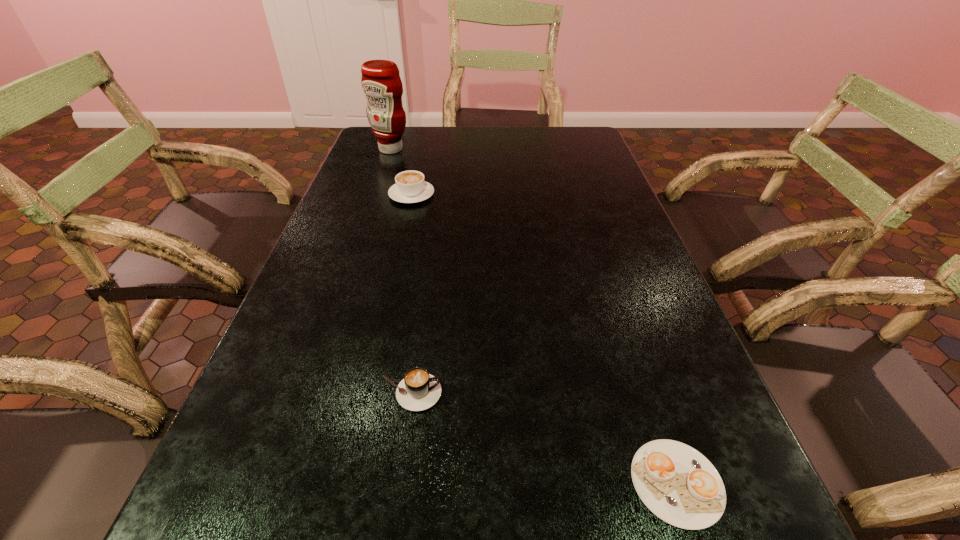
Identify the location of vacant space located 0.080m on the side of the second farthest object with the handle. (417, 171).

This screenshot has width=960, height=540. Find the location of `vacant position located on the side of the second farthest object with the handle`. vacant position located on the side of the second farthest object with the handle is located at coordinates (424, 140).

This screenshot has height=540, width=960. I want to click on free space located with the handle on the side of the second nearest cappuccino, so click(511, 393).

Find the location of `free space located on the back of the nearest cappuccino`. free space located on the back of the nearest cappuccino is located at coordinates (650, 402).

Locate an element on the screen. Image resolution: width=960 pixels, height=540 pixels. object that is at the far edge is located at coordinates [381, 83].

The width and height of the screenshot is (960, 540). Find the location of `condiment that is at the left edge`. condiment that is at the left edge is located at coordinates (381, 83).

Where is `cappuccino located at the left edge`? cappuccino located at the left edge is located at coordinates (410, 187).

At what (x,y) coordinates should I click in order to perform the action: click on object at the right edge. Please return your answer as a coordinate pair (x, y). Looking at the image, I should click on (677, 483).

Locate an element on the screen. object located in the far left corner section of the desktop is located at coordinates (381, 83).

In the image, there is a desktop. Where is `vacant space at the far edge`? This screenshot has height=540, width=960. vacant space at the far edge is located at coordinates (443, 134).